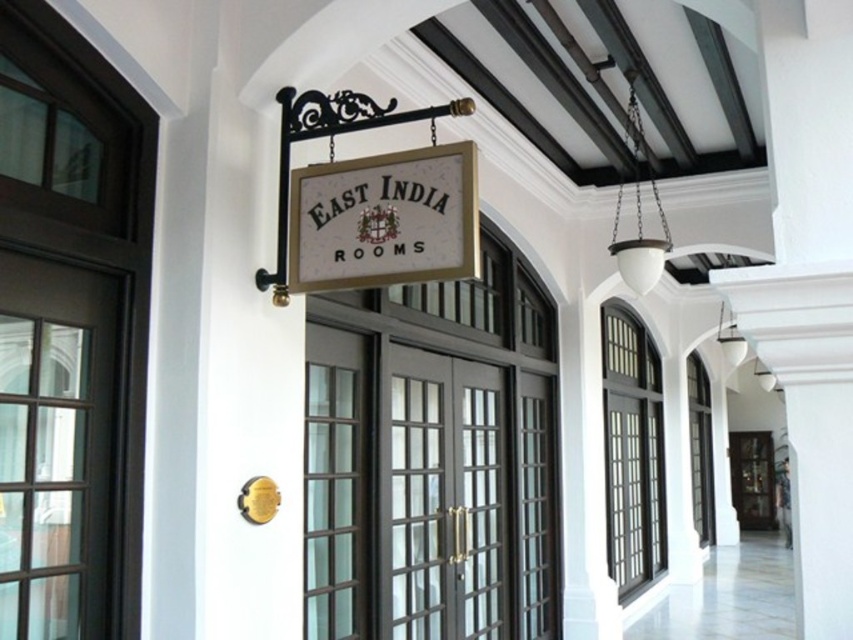
Consider the image. Between matte black door at center and white wood sign at center, which one is positioned lower?

matte black door at center is below.

Is matte black door at center smaller than white wood sign at center?

No, matte black door at center is not smaller than white wood sign at center.

Is point (392, 454) less distant than point (347, 218)?

No.

Where is `matte black door at center`? This screenshot has height=640, width=853. matte black door at center is located at coordinates (445, 497).